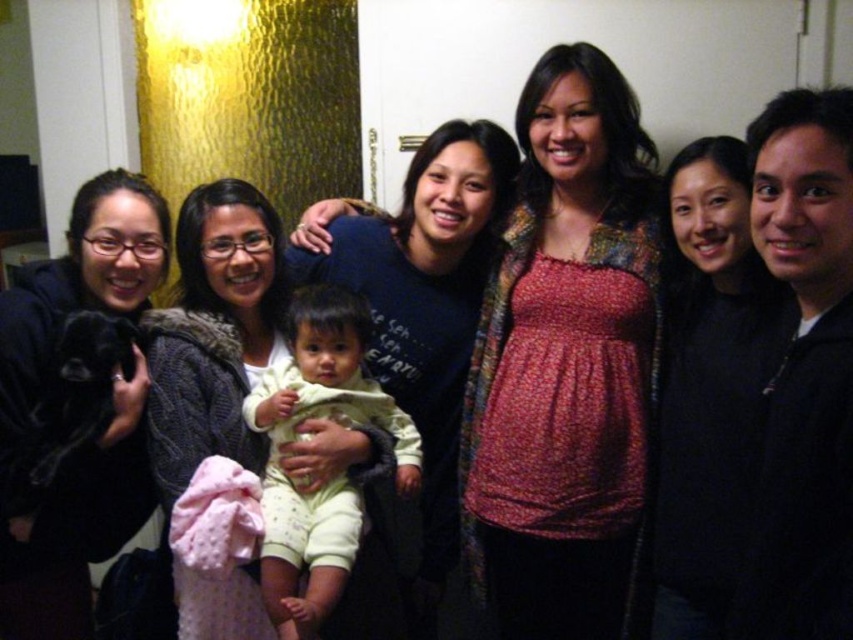
Is black zip-up jacket at right thinner than light yellow fabric at center?

Indeed, black zip-up jacket at right has a lesser width compared to light yellow fabric at center.

Consider the image. Which is below, black zip-up jacket at right or light yellow fabric at center?

light yellow fabric at center is below.

Is point (836, 220) in front of point (311, 340)?

Yes, point (836, 220) is in front of point (311, 340).

Locate an element on the screen. This screenshot has height=640, width=853. black zip-up jacket at right is located at coordinates (805, 369).

Image resolution: width=853 pixels, height=640 pixels. What are the coordinates of `floral-patterned blouse at center` in the screenshot? It's located at (566, 362).

Who is taller, floral-patterned blouse at center or black fuzzy dog at left?

With more height is floral-patterned blouse at center.

Between point (503, 259) and point (62, 296), which one is positioned behind?

Positioned behind is point (503, 259).

At what (x,y) coordinates should I click in order to perform the action: click on floral-patterned blouse at center. Please return your answer as a coordinate pair (x, y). The height and width of the screenshot is (640, 853). Looking at the image, I should click on (566, 362).

Is black fuzzy dog at left bigger than light yellow fabric at center?

Yes, black fuzzy dog at left is bigger than light yellow fabric at center.

Where is `black fuzzy dog at left`? Image resolution: width=853 pixels, height=640 pixels. black fuzzy dog at left is located at coordinates (62, 412).

Describe the element at coordinates (62, 412) in the screenshot. I see `black fuzzy dog at left` at that location.

Locate an element on the screen. This screenshot has height=640, width=853. black fuzzy dog at left is located at coordinates (62, 412).